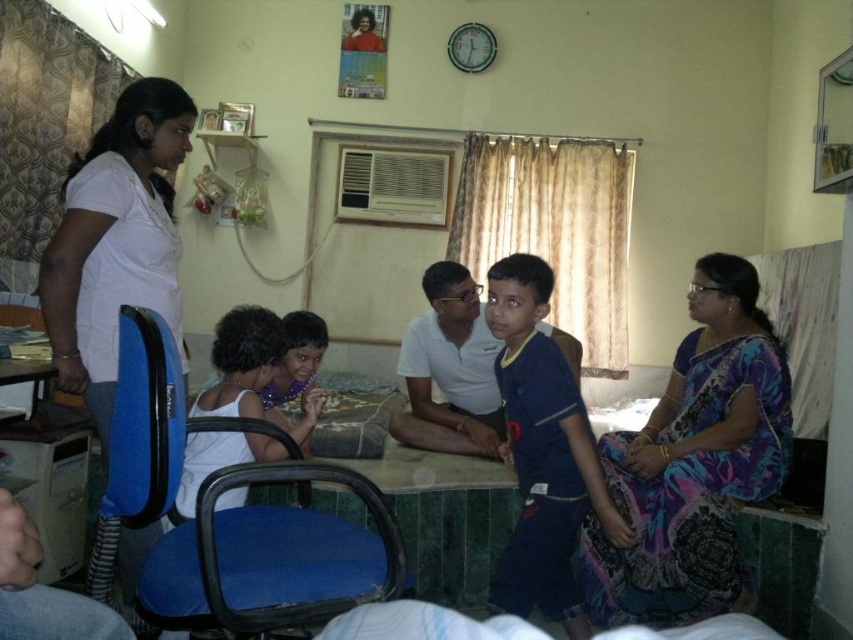
Question: Can you confirm if blue fabric chair at lower left is smaller than white matte shirt at left?

Choices:
 (A) yes
 (B) no

Answer: (B)

Question: Which point is closer to the camera?

Choices:
 (A) white matte shirt at left
 (B) printed silk saree at lower right
 (C) blue fabric chair at lower left
 (D) matte white shirt at lower left

Answer: (C)

Question: Considering the real-world distances, which object is closest to the green marble table at center?

Choices:
 (A) printed silk saree at lower right
 (B) matte white shirt at lower left
 (C) white matte shirt at left
 (D) blue fabric chair at lower left

Answer: (B)

Question: Can you confirm if green marble table at center is positioned above matte white shirt at lower left?

Choices:
 (A) yes
 (B) no

Answer: (B)

Question: Which of the following is the closest to the observer?

Choices:
 (A) matte white shirt at lower left
 (B) printed silk saree at lower right
 (C) green marble table at center
 (D) blue fabric chair at lower left

Answer: (D)

Question: Can you confirm if printed silk saree at lower right is thinner than matte white shirt at lower left?

Choices:
 (A) no
 (B) yes

Answer: (A)